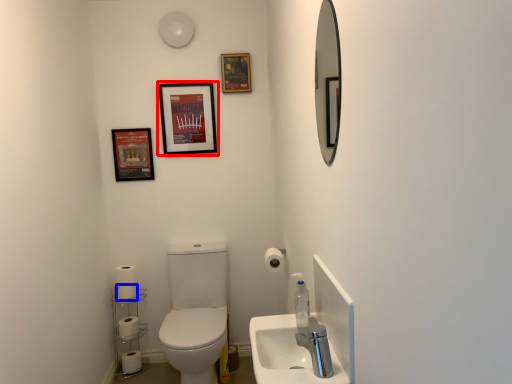
Question: Among these objects, which one is farthest to the camera, picture frame (highlighted by a red box) or toilet paper (highlighted by a blue box)?

Choices:
 (A) picture frame
 (B) toilet paper

Answer: (A)